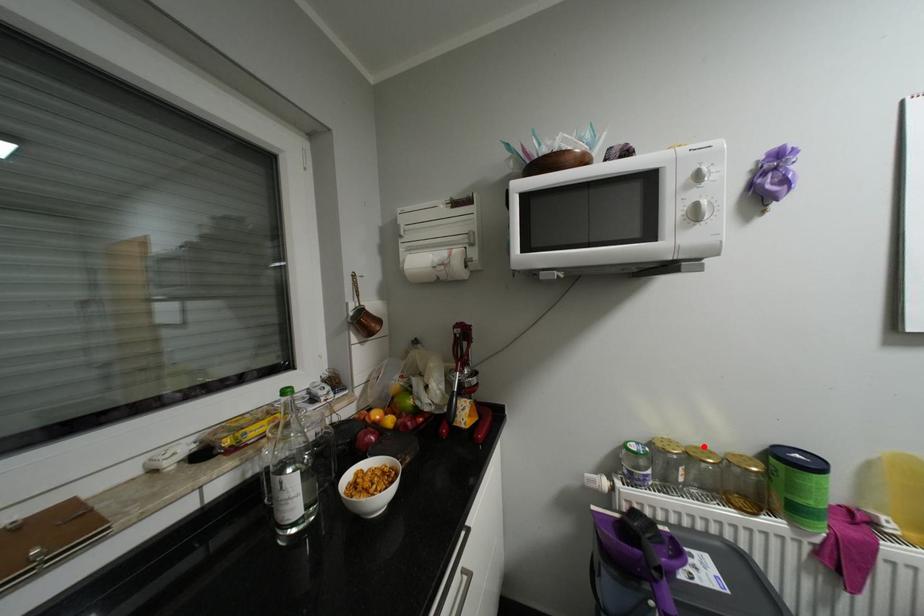
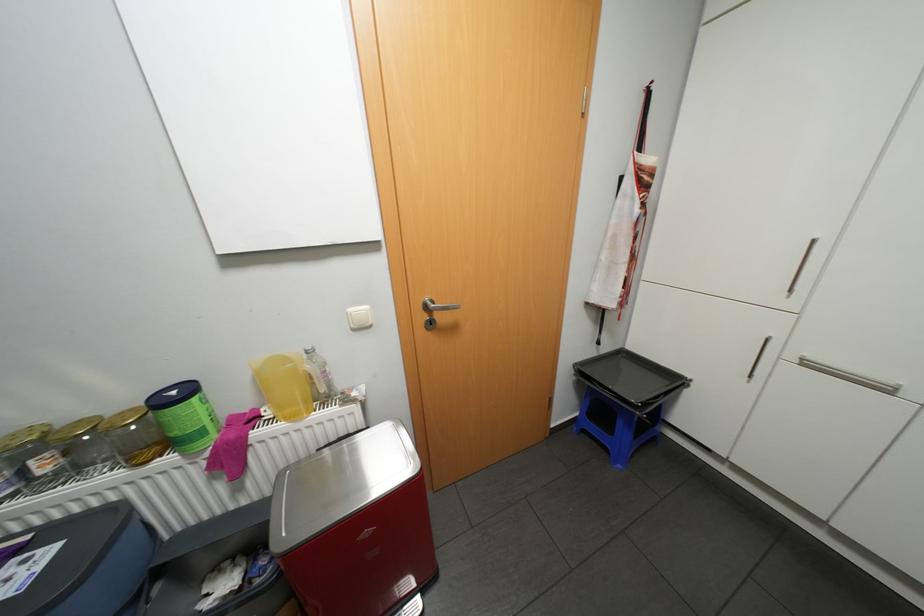
The point at the highlighted location is marked in the first image. Where is the corresponding point in the second image?

(88, 419)